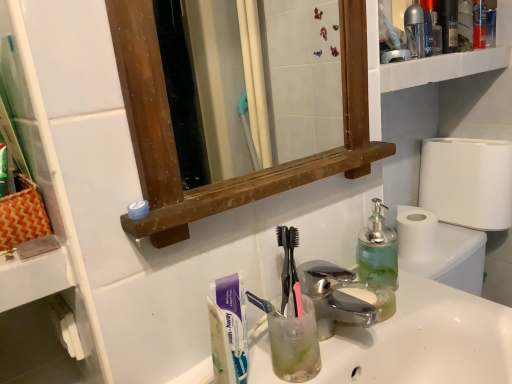
Question: Is green translucent soap dispenser at right, which appears as the second bottle when viewed from the back, at the right side of polished chrome faucet at center?

Choices:
 (A) no
 (B) yes

Answer: (B)

Question: Can you confirm if green translucent soap dispenser at right, the first bottle in the bottom-to-top sequence, is thinner than polished chrome faucet at center?

Choices:
 (A) no
 (B) yes

Answer: (B)

Question: Can you confirm if green translucent soap dispenser at right, the 1th bottle when ordered from front to back, is bigger than polished chrome faucet at center?

Choices:
 (A) yes
 (B) no

Answer: (A)

Question: Does green translucent soap dispenser at right, the 1th bottle when ordered from front to back, have a lesser height compared to polished chrome faucet at center?

Choices:
 (A) no
 (B) yes

Answer: (A)

Question: Can you see green translucent soap dispenser at right, which appears as the second bottle when viewed from the back, touching polished chrome faucet at center?

Choices:
 (A) no
 (B) yes

Answer: (A)

Question: From a real-world perspective, is green translucent soap dispenser at right, which appears as the second bottle when viewed from the back, beneath polished chrome faucet at center?

Choices:
 (A) yes
 (B) no

Answer: (B)

Question: Are green translucent soap dispenser at right, the first bottle in the bottom-to-top sequence, and orange woven picnic basket at left beside each other?

Choices:
 (A) no
 (B) yes

Answer: (A)

Question: Is green translucent soap dispenser at right, the first bottle in the bottom-to-top sequence, surrounding orange woven picnic basket at left?

Choices:
 (A) yes
 (B) no

Answer: (B)

Question: Is green translucent soap dispenser at right, arranged as the first bottle when viewed from the left, in front of orange woven picnic basket at left?

Choices:
 (A) yes
 (B) no

Answer: (B)

Question: Is green translucent soap dispenser at right, the second bottle viewed from the top, aimed at orange woven picnic basket at left?

Choices:
 (A) yes
 (B) no

Answer: (B)

Question: Can you confirm if green translucent soap dispenser at right, positioned as the second bottle in right-to-left order, is taller than orange woven picnic basket at left?

Choices:
 (A) yes
 (B) no

Answer: (A)

Question: Does green translucent soap dispenser at right, which appears as the second bottle when viewed from the back, have a smaller size compared to orange woven picnic basket at left?

Choices:
 (A) yes
 (B) no

Answer: (A)

Question: Is white paper toilet roll at right outside of green translucent soap dispenser at right, which appears as the second bottle when viewed from the back?

Choices:
 (A) no
 (B) yes

Answer: (B)